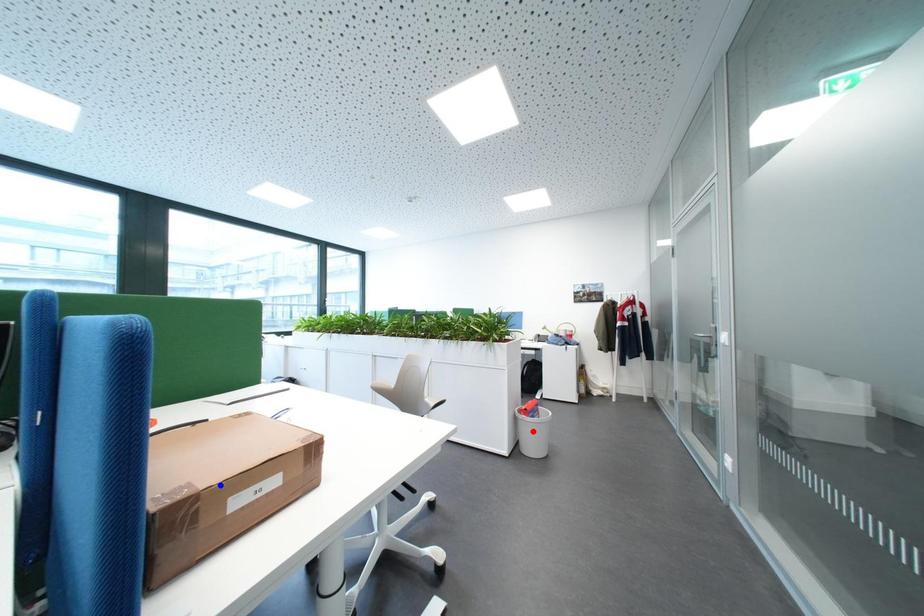
Question: In the image, two points are highlighted. Which point is nearer to the camera? Reply with the corresponding letter.

Choices:
 (A) blue point
 (B) red point

Answer: (A)